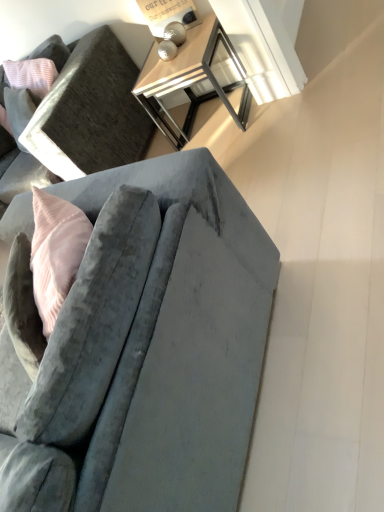
You are a GUI agent. You are given a task and a screenshot of the screen. Output one action in this format:
    pyautogui.click(x=<x>, y=<y>)
    Task: Click on the free location in front of metallic silver table at upper center
    Image resolution: width=384 pixels, height=512 pixels.
    Given the screenshot: What is the action you would take?
    pyautogui.click(x=262, y=130)